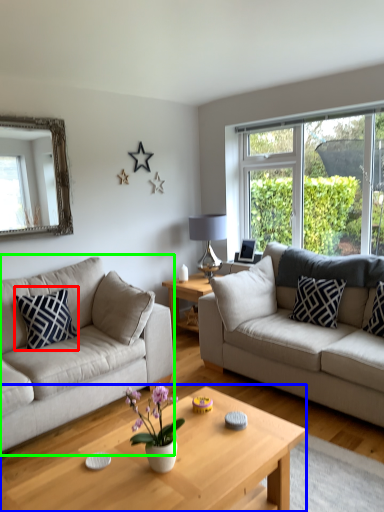
Question: Considering the real-world distances, which object is farthest from pillow (highlighted by a red box)? coffee table (highlighted by a blue box) or studio couch (highlighted by a green box)?

Choices:
 (A) coffee table
 (B) studio couch

Answer: (A)